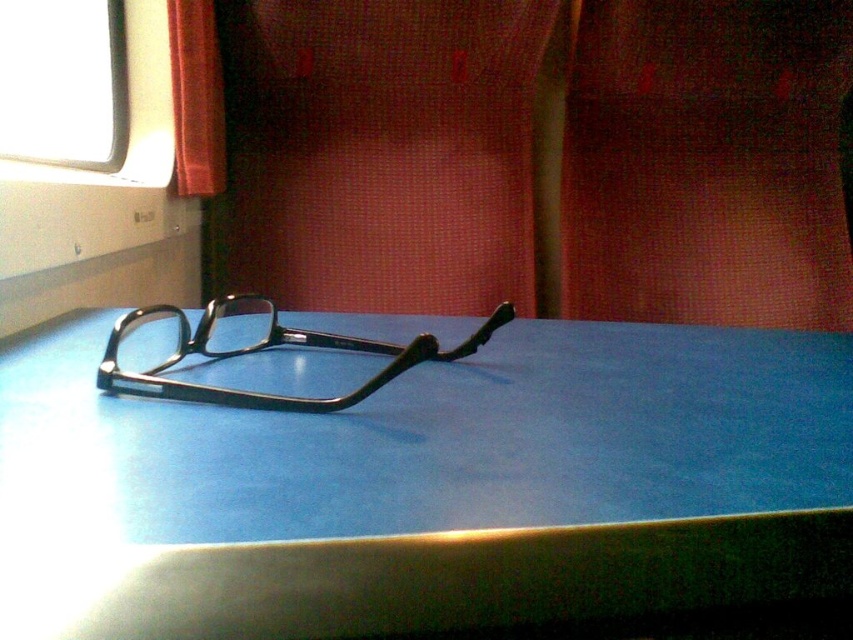
You are holding a 12 inch ruler and want to place it on the blue matte table at center. Can you fit the ruler entirely on the table without any part hanging off?

The distance between the blue matte table at center and the viewer is 13.17 inches. Since the ruler is 12 inches long, it can be placed entirely on the table as the table is longer than the ruler.